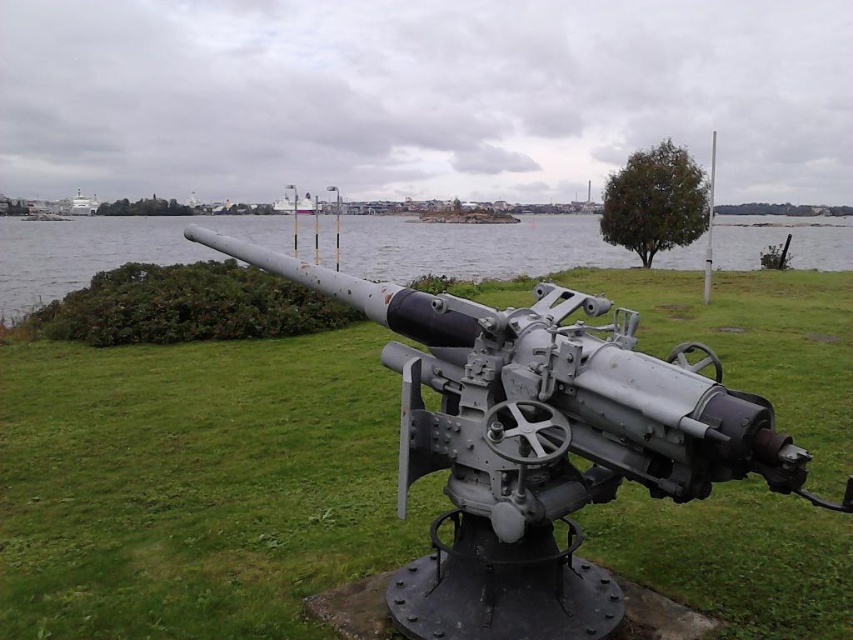
Is gray metallic cannon at center thinner than gray metallic water at center?

Yes.

Describe the element at coordinates (538, 444) in the screenshot. I see `gray metallic cannon at center` at that location.

This screenshot has width=853, height=640. What do you see at coordinates (538, 444) in the screenshot?
I see `gray metallic cannon at center` at bounding box center [538, 444].

The height and width of the screenshot is (640, 853). Find the location of `gray metallic cannon at center`. gray metallic cannon at center is located at coordinates (538, 444).